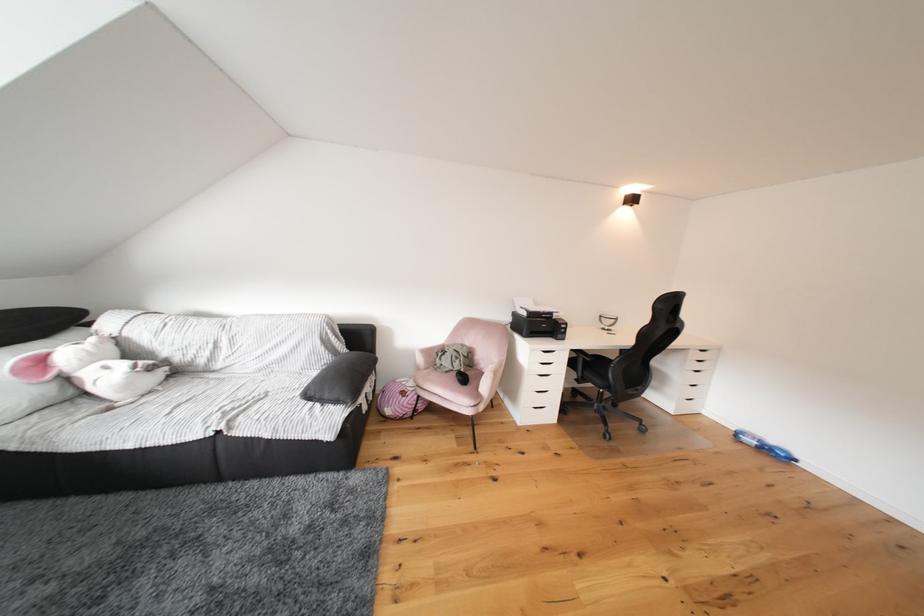
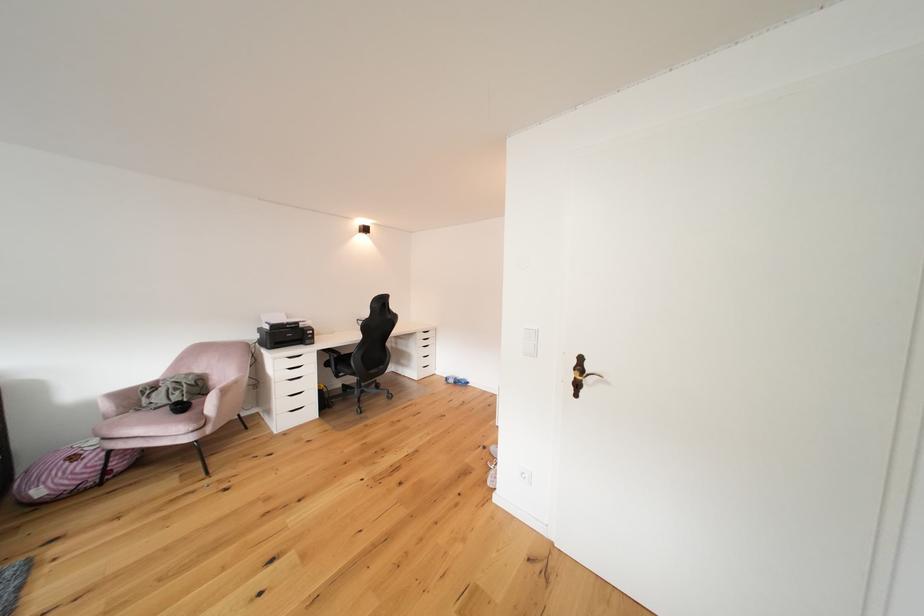
Locate, in the second image, the point that corresponds to the point at 477,347 in the first image.

(208, 374)